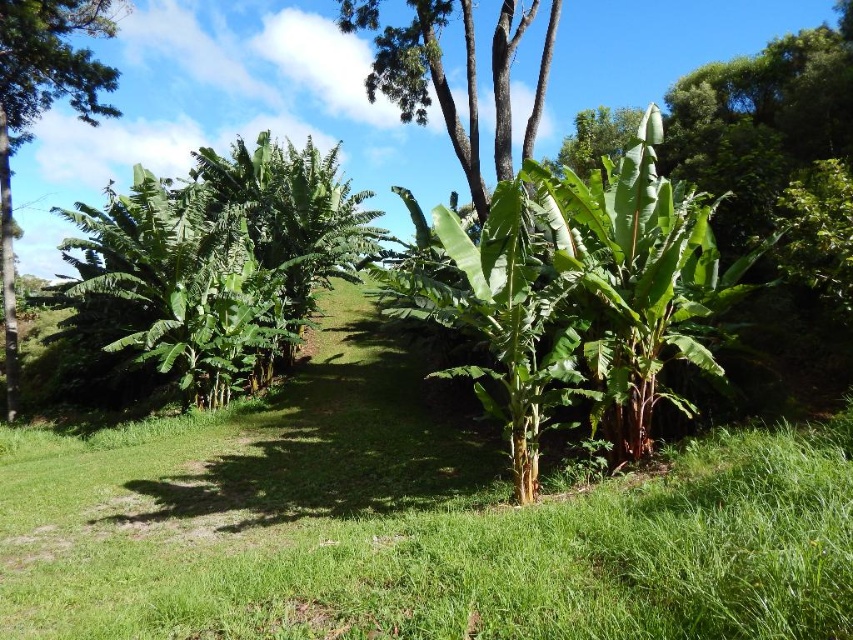
You are standing in a tropical garden and want to take a photo of the green leafy banana tree at center. If you are currently 18.38 feet away from it, is this distance considered close enough to capture clear details of the tree in your photo?

The distance between you and the green leafy banana tree at center is 18.38 feet. This distance may be too far to capture clear details of the tree in a standard photo without zoom. Consider moving closer for better detail.

You are an environmental scientist studying the spatial arrangement of plants in a tropical forest. You observe the green leafy banana tree at left and the green leafy tree at center. Which tree has a narrower canopy width?

The green leafy banana tree at left has a lesser width compared to the green leafy tree at center, so the green leafy banana tree at left has a narrower canopy width.

You are standing in the tropical garden and want to walk from the green leafy banana tree at left to the green leafy tree at center. Which direction should you move to reach the destination?

The green leafy banana tree at left is positioned on the left side of green leafy tree at center, so you should move to the right to reach the green leafy tree at center from the green leafy banana tree at left.